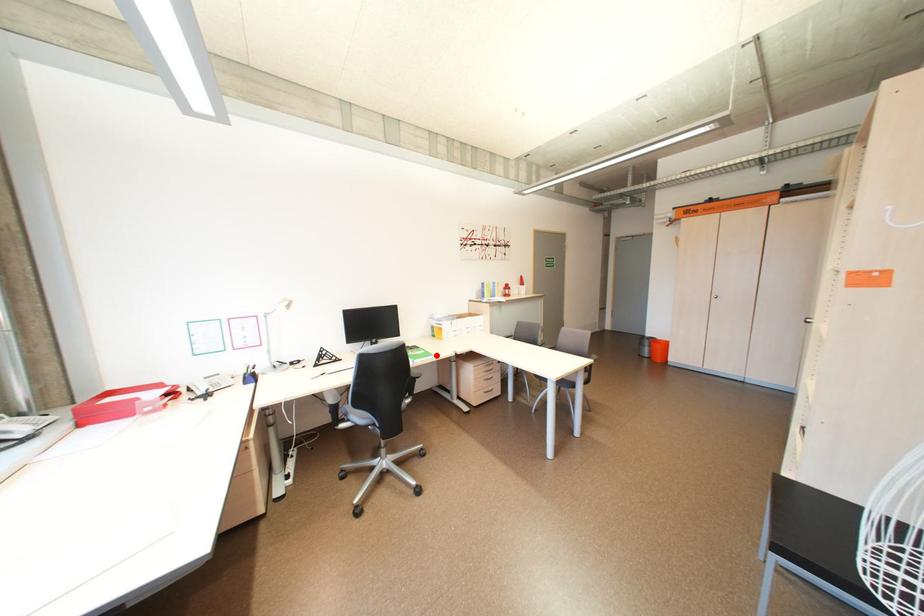
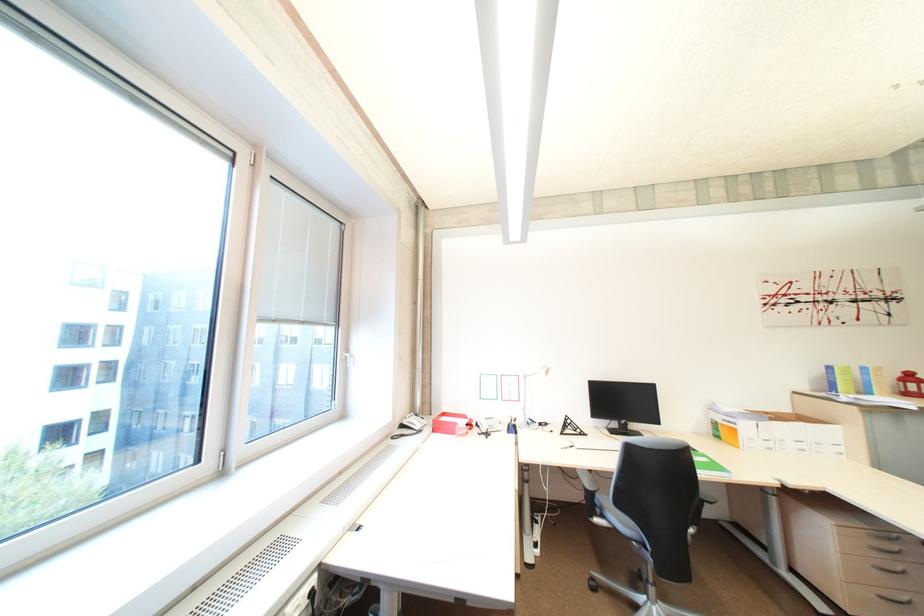
Locate, in the second image, the point that corresponds to the highlighted location in the first image.

(725, 468)